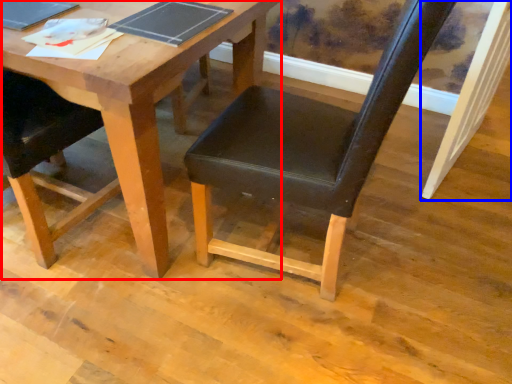
Question: Which object is closer to the camera taking this photo, table (highlighted by a red box) or plank (highlighted by a blue box)?

Choices:
 (A) table
 (B) plank

Answer: (A)